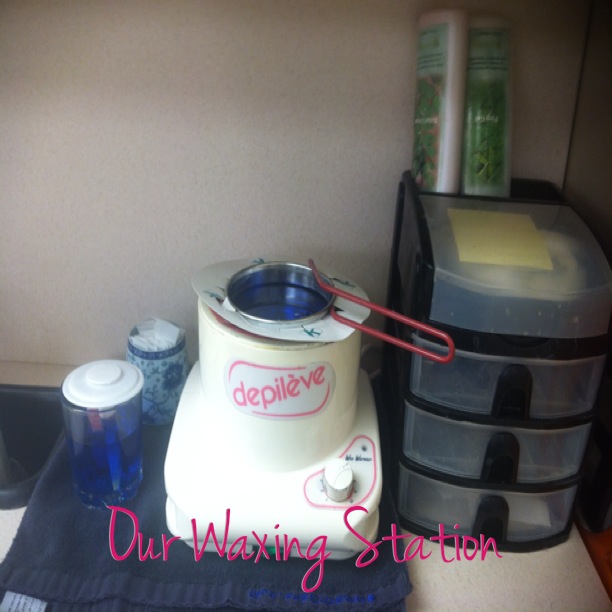
You are a GUI agent. You are given a task and a screenshot of the screen. Output one action in this format:
    pyautogui.click(x=<x>, y=<y>)
    Task: Click on the wax melter
    This screenshot has height=612, width=612.
    Given the screenshot: What is the action you would take?
    pyautogui.click(x=275, y=420)